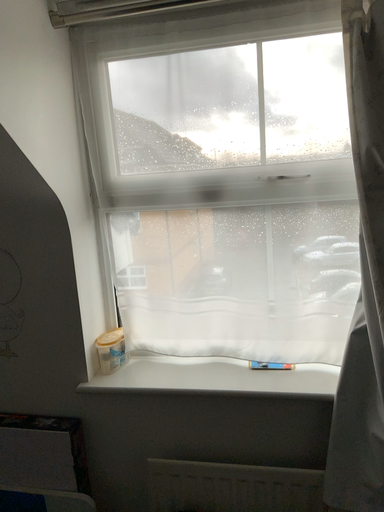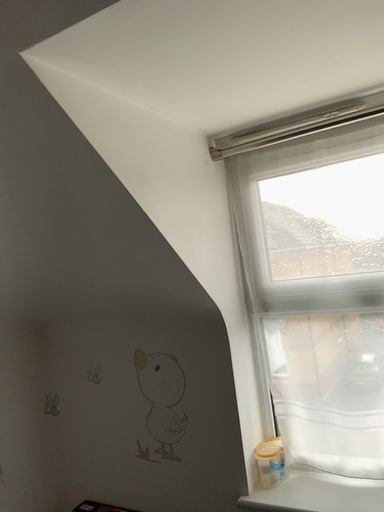
Question: Which way did the camera rotate in the video?

Choices:
 (A) rotated left
 (B) rotated right

Answer: (A)